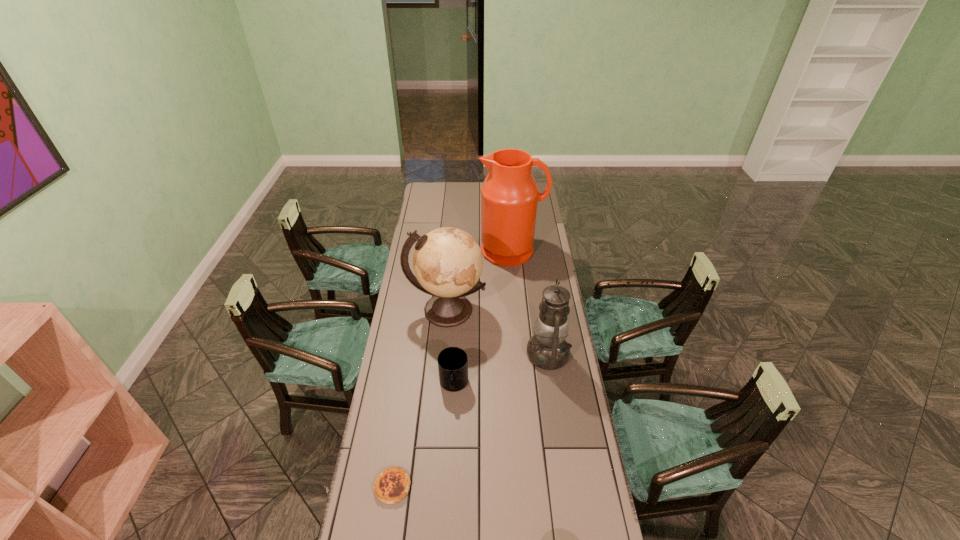
Where is `free space between the second shortest object and the tallest object`? free space between the second shortest object and the tallest object is located at coordinates (483, 318).

At what (x,y) coordinates should I click in order to perform the action: click on unoccupied position between the shortest object and the oil lamp. Please return your answer as a coordinate pair (x, y). The height and width of the screenshot is (540, 960). Looking at the image, I should click on (470, 421).

At what (x,y) coordinates should I click in order to perform the action: click on vacant area that lies between the nearest object and the second shortest object. Please return your answer as a coordinate pair (x, y). Looking at the image, I should click on (423, 436).

Locate an element on the screen. vacant region between the shortest object and the oil lamp is located at coordinates (470, 421).

The image size is (960, 540). Identify the location of object that stands as the closest to the mug. (447, 262).

Identify which object is the third closest to the oil lamp. Please provide its 2D coordinates. Your answer should be formatted as a tuple, i.e. [(x, y)], where the tuple contains the x and y coordinates of a point satisfying the conditions above.

[(509, 195)]

Where is `vacant space that satisfies the following two spatial constraints: 1. from the spout of the oil lamp; 2. on the right side of the water jug`? vacant space that satisfies the following two spatial constraints: 1. from the spout of the oil lamp; 2. on the right side of the water jug is located at coordinates pos(520,355).